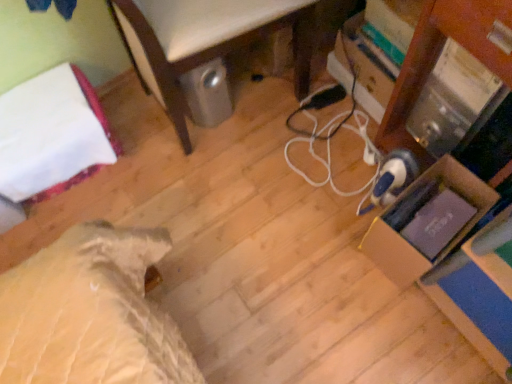
Question: Choose the correct answer: Is white fabric bed at left inside cardboard box at right or outside it?

Choices:
 (A) outside
 (B) inside

Answer: (A)

Question: Considering the positions of white fabric bed at left and cardboard box at right in the image, is white fabric bed at left taller or shorter than cardboard box at right?

Choices:
 (A) tall
 (B) short

Answer: (B)

Question: Estimate the real-world distances between objects in this image. Which object is farther from the white fabric bed at left?

Choices:
 (A) metallic silver trash can at lower center
 (B) cardboard box at right
 (C) white cord at center

Answer: (B)

Question: Which object is the farthest from the metallic silver trash can at lower center?

Choices:
 (A) white cord at center
 (B) cardboard box at right
 (C) white fabric bed at left

Answer: (B)